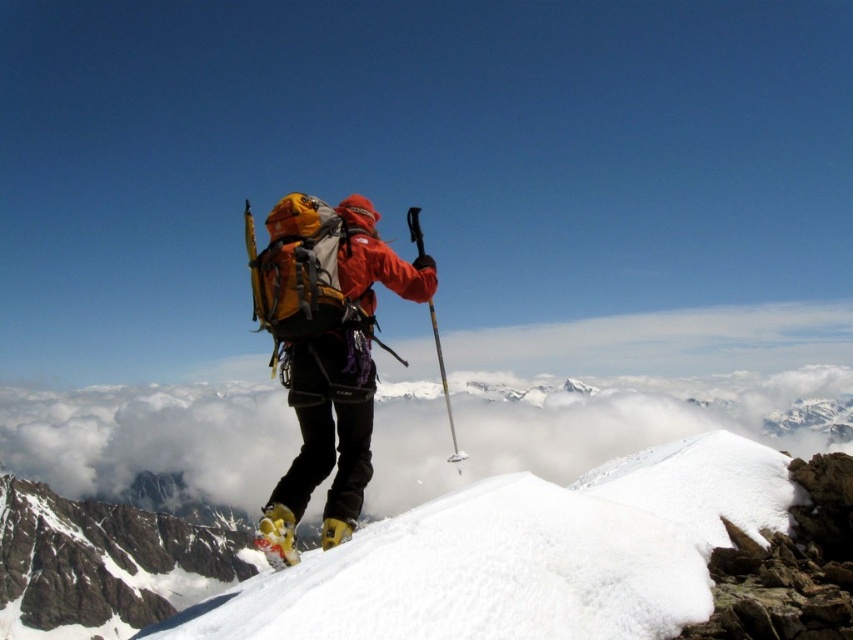
You are a mountain rescue team member assessing the scene. You see the matte orange jacket at center and the yellow matte ski at center. Which object is higher in elevation?

The matte orange jacket at center is taller than the yellow matte ski at center, so the matte orange jacket at center is higher in elevation.

You are a photographer planning to take a photo of the matte orange jacket at center and the yellow matte ski at center. Which object should you focus on first if you want to capture both in the same frame without moving the camera?

You should focus on the matte orange jacket at center first because it is larger than the yellow matte ski at center, ensuring it is in clear view before adjusting for the smaller object.

You are a mountain rescue team member trying to locate a climber who left two items on a snowfield. You have a map showing the coordinates of the yellow matte ski at center and the yellow metallic ski pole at center. According to the map, how far apart are these two items?

The yellow matte ski at center is 691.63 feet away from the yellow metallic ski pole at center.